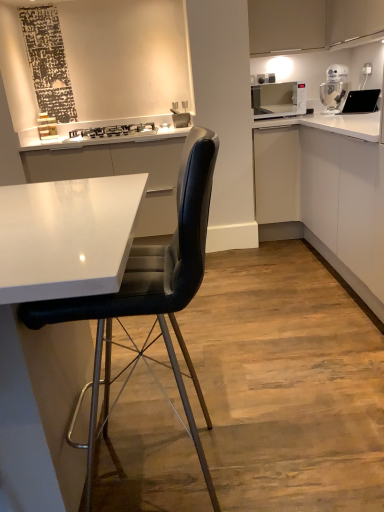
You are a GUI agent. You are given a task and a screenshot of the screen. Output one action in this format:
    pyautogui.click(x=<x>, y=<y>)
    Task: Click on the free spot behind black leather chair at center
    Image resolution: width=384 pixels, height=512 pixels.
    Given the screenshot: What is the action you would take?
    pyautogui.click(x=186, y=389)